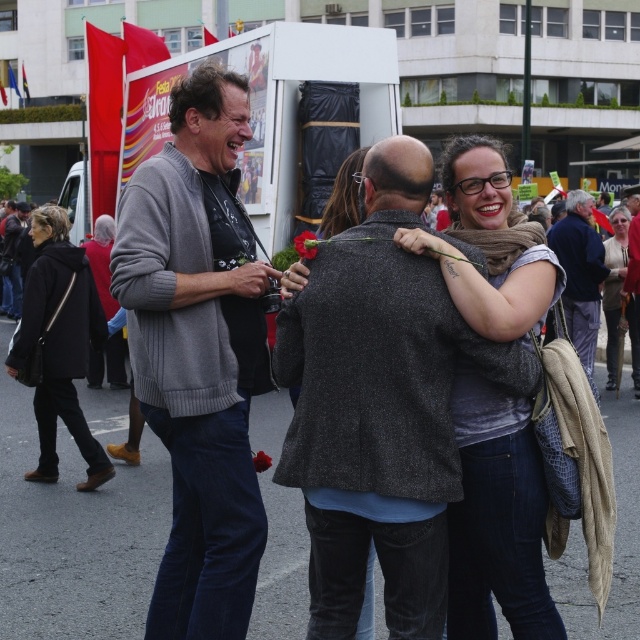
What object is located at the coordinate point (198, 353) in the scene?

The point (198, 353) marks the gray knitted sweater at left.

You are a photographer standing at the center of the scene. You want to take a photo of the gray knitted sweater at left and the light beige scarf at center. Can you capture both in a single frame without moving your camera? Explain your reasoning based on their distance.

The gray knitted sweater at left is 8.14 meters away from the light beige scarf at center. Since the distance between them is significant, it might be challenging to capture both in a single frame without moving the camera. However, using a wide angle lens could potentially include both subjects in the shot.